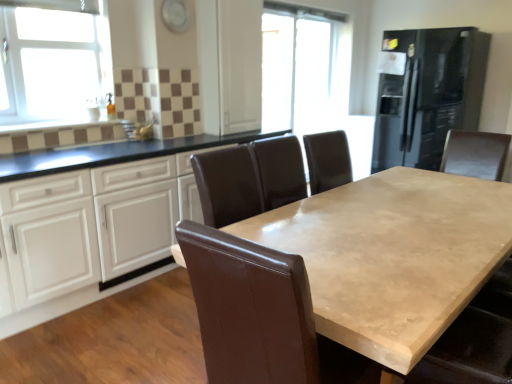
Question: From a real-world perspective, is transparent glass door at center above or below brown leather swivel chair at center?

Choices:
 (A) above
 (B) below

Answer: (A)

Question: Based on their positions, is transparent glass door at center located to the left or right of brown leather swivel chair at center?

Choices:
 (A) left
 (B) right

Answer: (B)

Question: Estimate the real-world distances between objects in this image. Which object is farther from the white glossy cabinets at center?

Choices:
 (A) black glass refrigerator at right
 (B) white glass window at upper left
 (C) beige polished wood table at center
 (D) brown leather swivel chair at center
 (E) transparent glass door at center

Answer: (A)

Question: Considering the real-world distances, which object is closest to the black glass refrigerator at right?

Choices:
 (A) beige polished wood table at center
 (B) transparent glass door at center
 (C) white glass window at upper left
 (D) white glossy cabinets at center
 (E) brown leather swivel chair at center

Answer: (B)